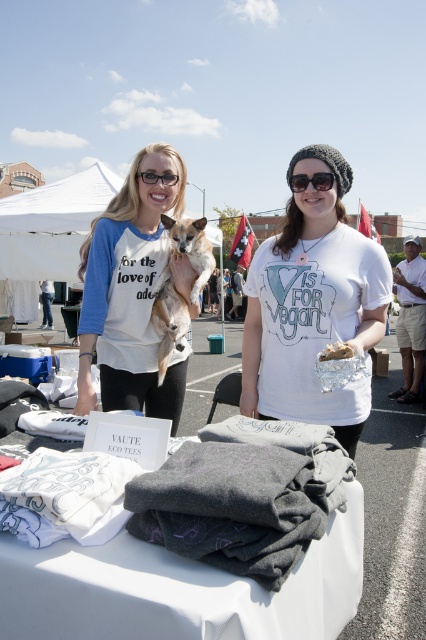
Is black knit beanie at upper center positioned in front of clear plastic bag at center?

No, black knit beanie at upper center is further to the viewer.

Is black knit beanie at upper center below clear plastic bag at center?

No, black knit beanie at upper center is not below clear plastic bag at center.

Does point (291, 186) lie behind point (342, 356)?

Yes, it is behind point (342, 356).

You are a GUI agent. You are given a task and a screenshot of the screen. Output one action in this format:
    pyautogui.click(x=<x>, y=<y>)
    Task: Click on the black knit beanie at upper center
    
    Given the screenshot: What is the action you would take?
    pyautogui.click(x=311, y=180)

Can you confirm if white fabric shirts at lower center is bigger than black knit beanie at upper center?

Correct, white fabric shirts at lower center is larger in size than black knit beanie at upper center.

At what (x,y) coordinates should I click in order to perform the action: click on white fabric shirts at lower center. Please return your answer as a coordinate pair (x, y). Image resolution: width=426 pixels, height=640 pixels. Looking at the image, I should click on (175, 588).

Where is `white fabric shirts at lower center`? This screenshot has height=640, width=426. white fabric shirts at lower center is located at coordinates (175, 588).

Who is more distant from viewer, (60, 630) or (184, 262)?

Point (184, 262)

The height and width of the screenshot is (640, 426). I want to click on white fabric shirts at lower center, so click(x=175, y=588).